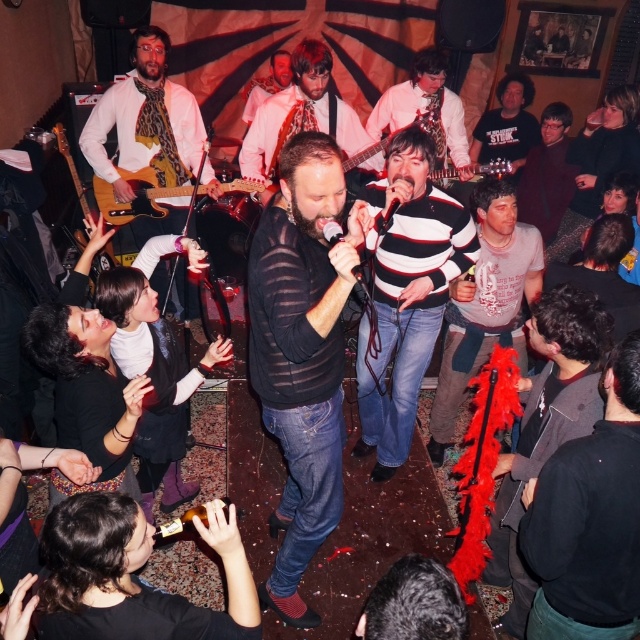
Who is more distant from viewer, (298,147) or (392,292)?

Point (392,292)

Is black sheer shirt at center smaller than striped sweater at center?

Yes, black sheer shirt at center is smaller than striped sweater at center.

Is point (285, 163) farther from viewer compared to point (374, 397)?

No, (285, 163) is in front of (374, 397).

This screenshot has width=640, height=640. Identify the location of black sheer shirt at center. (301, 353).

What do you see at coordinates (301, 116) in the screenshot?
I see `white shirt with red tie at center` at bounding box center [301, 116].

Does white shirt with red tie at center appear on the right side of dark gray sweater at upper right?

Incorrect, white shirt with red tie at center is not on the right side of dark gray sweater at upper right.

Is point (298, 115) closer to viewer compared to point (524, 156)?

Yes.

You are a GUI agent. You are given a task and a screenshot of the screen. Output one action in this format:
    pyautogui.click(x=<x>, y=<y>)
    Task: Click on the white shirt with red tie at center
    
    Given the screenshot: What is the action you would take?
    pyautogui.click(x=301, y=116)

Between striped sweater at center and white shirt with red tie at center, which one has more height?

With more height is striped sweater at center.

Where is `striped sweater at center`? The width and height of the screenshot is (640, 640). striped sweater at center is located at coordinates (404, 292).

Where is `striped sweater at center`? striped sweater at center is located at coordinates 404,292.